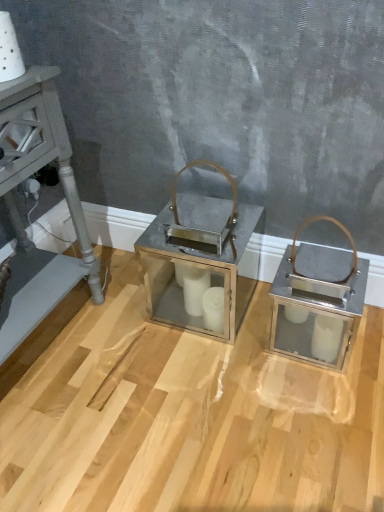
This screenshot has width=384, height=512. What are the coordinates of `metallic silver lantern at center` in the screenshot? It's located at (204, 268).

Describe the element at coordinates (204, 268) in the screenshot. I see `metallic silver lantern at center` at that location.

What is the approximate height of metallic gray side table at left?

metallic gray side table at left is 29.61 inches tall.

Locate an element on the screen. metallic gray side table at left is located at coordinates (65, 196).

What do you see at coordinates (65, 196) in the screenshot?
I see `metallic gray side table at left` at bounding box center [65, 196].

The image size is (384, 512). What are the coordinates of `metallic silver lantern at center` in the screenshot? It's located at (204, 268).

Does metallic silver lantern at center appear on the left side of metallic gray side table at left?

In fact, metallic silver lantern at center is to the right of metallic gray side table at left.

Considering the relative positions of metallic silver lantern at center and metallic gray side table at left in the image provided, is metallic silver lantern at center in front of metallic gray side table at left?

No, the depth of metallic silver lantern at center is greater than that of metallic gray side table at left.

Does point (258, 230) appear closer or farther from the camera than point (21, 132)?

Point (258, 230) is farther from the camera than point (21, 132).

From the image's perspective, between metallic silver lantern at center and metallic gray side table at left, which one is located above?

metallic silver lantern at center appears higher in the image.

From a real-world perspective, is metallic silver lantern at center physically above metallic gray side table at left?

Incorrect, from a real-world perspective, metallic silver lantern at center is lower than metallic gray side table at left.

Which object is thinner, metallic silver lantern at center or metallic gray side table at left?

metallic silver lantern at center is thinner.

In terms of height, does metallic silver lantern at center look taller or shorter compared to metallic gray side table at left?

Considering their sizes, metallic silver lantern at center has less height than metallic gray side table at left.

Between metallic silver lantern at center and metallic gray side table at left, which one has smaller size?

metallic silver lantern at center.

Is metallic silver lantern at center positioned beyond the bounds of metallic gray side table at left?

That's correct, metallic silver lantern at center is outside of metallic gray side table at left.

Is metallic silver lantern at center touching metallic gray side table at left?

No, metallic silver lantern at center is not touching metallic gray side table at left.

Is metallic gray side table at left at the back of metallic silver lantern at center?

No, metallic silver lantern at center's orientation is not away from metallic gray side table at left.

You are a GUI agent. You are given a task and a screenshot of the screen. Output one action in this format:
    pyautogui.click(x=<x>, y=<y>)
    Task: Click on the table above the metallic gray side table at left (from the image's perspective)
    
    Given the screenshot: What is the action you would take?
    pyautogui.click(x=204, y=268)

Is metallic gray side table at left at the right side of metallic silver lantern at center?

No, metallic gray side table at left is not to the right of metallic silver lantern at center.

Considering the relative positions of metallic gray side table at left and metallic silver lantern at center in the image provided, is metallic gray side table at left in front of metallic silver lantern at center?

That is True.

Considering the positions of points (49, 111) and (208, 264), is point (49, 111) closer to camera compared to point (208, 264)?

Yes, point (49, 111) is in front of point (208, 264).

From the image's perspective, which is above, metallic gray side table at left or metallic silver lantern at center?

metallic silver lantern at center appears higher in the image.

From a real-world perspective, is metallic gray side table at left positioned above or below metallic silver lantern at center?

metallic gray side table at left is above metallic silver lantern at center.

Between metallic gray side table at left and metallic silver lantern at center, which one has smaller width?

metallic silver lantern at center is thinner.

Who is shorter, metallic gray side table at left or metallic silver lantern at center?

With less height is metallic silver lantern at center.

Is metallic gray side table at left smaller than metallic silver lantern at center?

Incorrect, metallic gray side table at left is not smaller in size than metallic silver lantern at center.

Looking at this image, is metallic gray side table at left positioned beyond the bounds of metallic silver lantern at center?

Yes, metallic gray side table at left is located beyond the bounds of metallic silver lantern at center.

Is metallic gray side table at left in contact with metallic silver lantern at center?

No, metallic gray side table at left is not in contact with metallic silver lantern at center.

Is metallic gray side table at left oriented away from metallic silver lantern at center?

No, metallic gray side table at left is not facing away from metallic silver lantern at center.

Can you tell me how much metallic gray side table at left and metallic silver lantern at center differ in facing direction?

The angle between the facing direction of metallic gray side table at left and the facing direction of metallic silver lantern at center is 86.8 degrees.

Measure the distance from metallic gray side table at left to metallic silver lantern at center.

metallic gray side table at left is 14.80 inches from metallic silver lantern at center.

At what (x,y) coordinates should I click in order to perform the action: click on table below the metallic gray side table at left (from a real-world perspective). Please return your answer as a coordinate pair (x, y). The width and height of the screenshot is (384, 512). Looking at the image, I should click on (204, 268).

At what (x,y) coordinates should I click in order to perform the action: click on table located behind the metallic gray side table at left. Please return your answer as a coordinate pair (x, y). The width and height of the screenshot is (384, 512). Looking at the image, I should click on (204, 268).

This screenshot has height=512, width=384. Identify the location of furniture in front of the metallic silver lantern at center. 65,196.